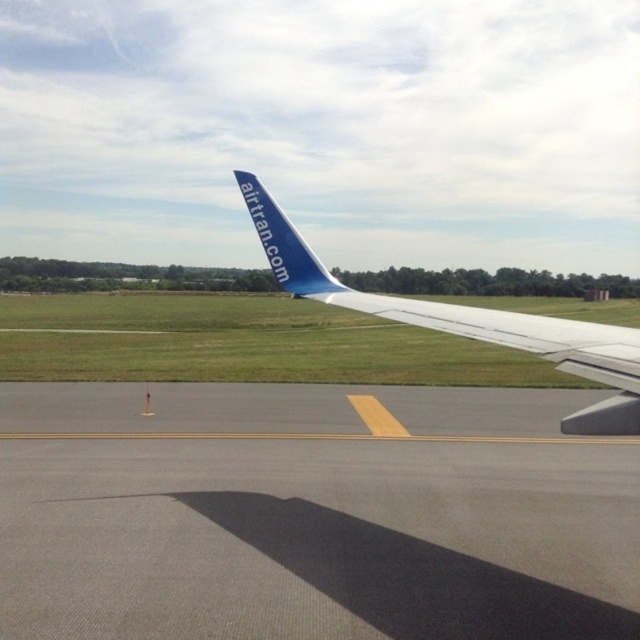
Question: Can you confirm if gray asphalt runway at lower center is bigger than blue matte airplane tail at upper center?

Choices:
 (A) yes
 (B) no

Answer: (A)

Question: Which point is closer to the camera?

Choices:
 (A) blue painted wing at center
 (B) blue matte airplane tail at upper center
 (C) gray asphalt runway at lower center

Answer: (A)

Question: Is white matte wing at center positioned behind blue matte airplane tail at upper center?

Choices:
 (A) yes
 (B) no

Answer: (B)

Question: Is blue painted wing at center positioned before blue matte airplane tail at upper center?

Choices:
 (A) yes
 (B) no

Answer: (A)

Question: Which point is closer to the camera taking this photo?

Choices:
 (A) (600, 358)
 (B) (632, 442)
 (C) (563, 349)

Answer: (A)

Question: Estimate the real-world distances between objects in this image. Which object is closer to the white matte wing at center?

Choices:
 (A) blue painted wing at center
 (B) blue matte airplane tail at upper center
 (C) gray asphalt runway at lower center

Answer: (A)